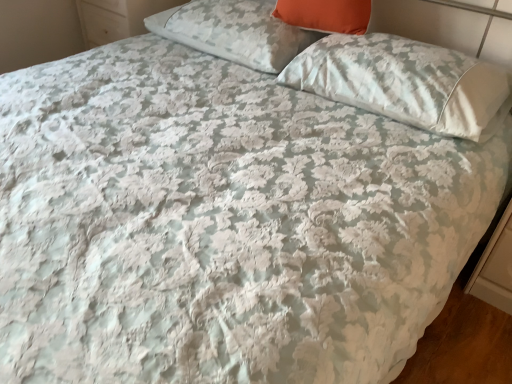
Question: In terms of size, does orange fabric pillow at upper center, acting as the 2th pillow starting from the right, appear bigger or smaller than white glossy dresser at upper left?

Choices:
 (A) small
 (B) big

Answer: (A)

Question: Do you think orange fabric pillow at upper center, acting as the 2th pillow starting from the left, is within white glossy dresser at upper left, or outside of it?

Choices:
 (A) inside
 (B) outside

Answer: (B)

Question: Based on their relative distances, which object is nearer to the white glossy dresser at upper left?

Choices:
 (A) orange fabric pillow at upper center, acting as the 2th pillow starting from the left
 (B) white satin pillow at upper right, placed as the 3th pillow when sorted from left to right
 (C) white floral fabric pillow at upper center, the first pillow when ordered from left to right

Answer: (C)

Question: Estimate the real-world distances between objects in this image. Which object is closer to the white floral fabric pillow at upper center, marked as the third pillow in a right-to-left arrangement?

Choices:
 (A) white glossy dresser at upper left
 (B) white satin pillow at upper right, marked as the 1th pillow in a right-to-left arrangement
 (C) orange fabric pillow at upper center, acting as the 2th pillow starting from the right

Answer: (C)